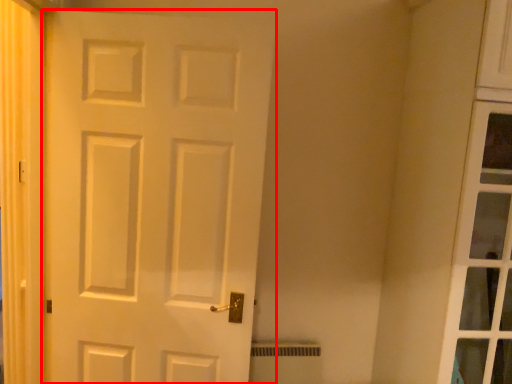
Question: In this image, where is door (annotated by the red box) located relative to curtain?

Choices:
 (A) right
 (B) left

Answer: (A)